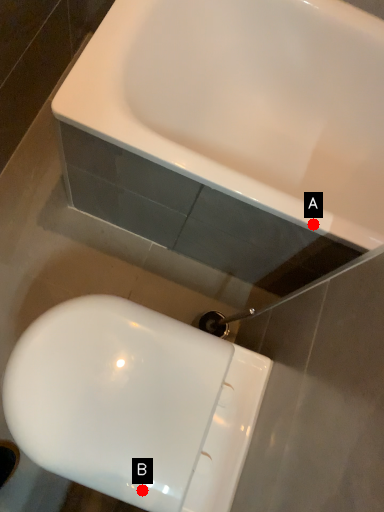
Question: Two points are circled on the image, labeled by A and B beside each circle. Which of the following is the farthest from the observer?

Choices:
 (A) A is further
 (B) B is further

Answer: (A)